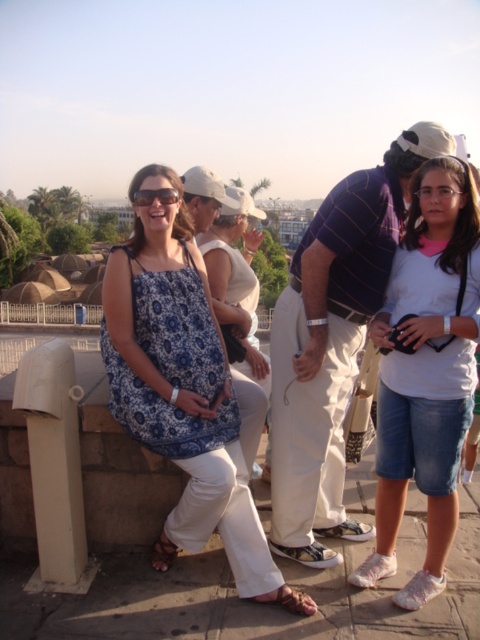
Question: Which of the following is the closest to the observer?

Choices:
 (A) blue printed dress at center
 (B) matte black sunglasses at center

Answer: (A)

Question: Can you confirm if blue printed dress at center is positioned above white cotton shirt at center?

Choices:
 (A) no
 (B) yes

Answer: (B)

Question: In this image, where is striped cotton shirt at center located relative to white cotton shirt at center?

Choices:
 (A) right
 (B) left

Answer: (A)

Question: Which point appears farthest from the camera in this image?

Choices:
 (A) (297, 348)
 (B) (172, 387)
 (C) (465, 193)
 (D) (176, 196)

Answer: (A)

Question: Estimate the real-world distances between objects in this image. Which object is farther from the matte black sunglasses at center?

Choices:
 (A) blue printed dress at center
 (B) white cotton shirt at center
 (C) striped cotton shirt at center

Answer: (B)

Question: Is blue printed dress at center positioned in front of matte black sunglasses at center?

Choices:
 (A) no
 (B) yes

Answer: (B)